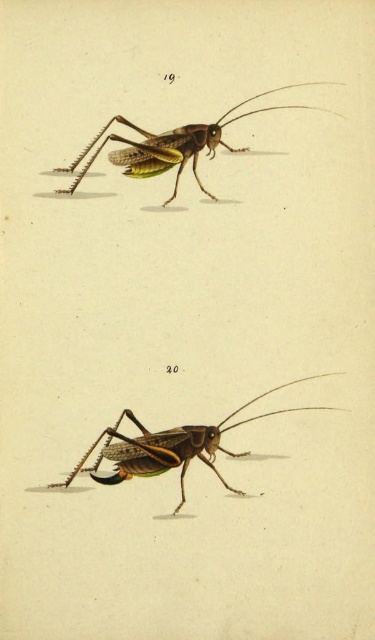
Question: Which point appears farthest from the camera in this image?

Choices:
 (A) (172, 464)
 (B) (109, 138)

Answer: (A)

Question: Which point is farther to the camera?

Choices:
 (A) shiny green grasshopper at upper center
 (B) shiny green exoskeleton at bottom center

Answer: (B)

Question: Is shiny green exoskeleton at bottom center thinner than shiny green grasshopper at upper center?

Choices:
 (A) yes
 (B) no

Answer: (B)

Question: Is shiny green exoskeleton at bottom center smaller than shiny green grasshopper at upper center?

Choices:
 (A) no
 (B) yes

Answer: (A)

Question: Is shiny green exoskeleton at bottom center below shiny green grasshopper at upper center?

Choices:
 (A) yes
 (B) no

Answer: (A)